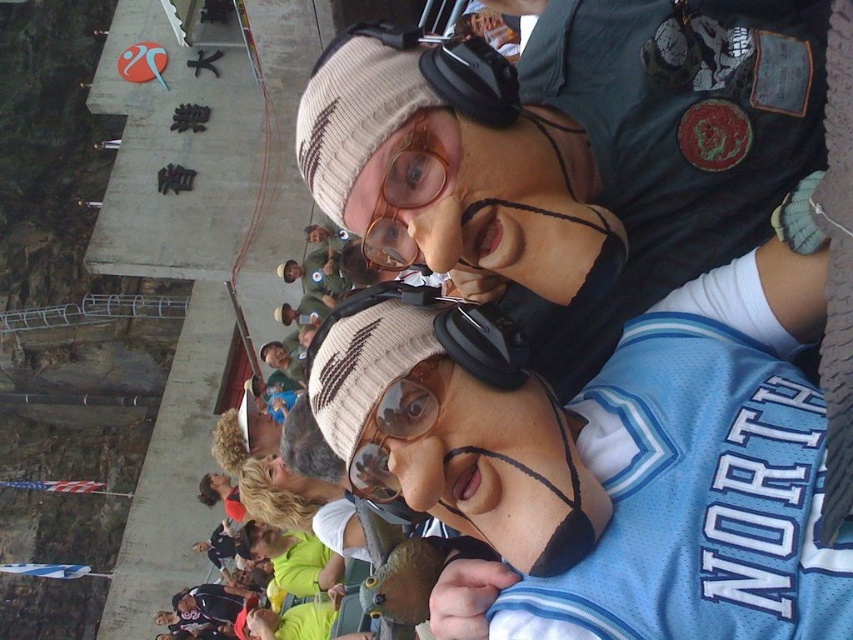
You are a photographer standing in front of the two people in the image. You notice the knit cap at upper center and the matte plastic goggles at center. Which object is closer to you?

The knit cap at upper center is closer to you because it is further to the viewer than the matte plastic goggles at center.

You are a photographer trying to capture a closeup of the knit cap at upper center and the clear plastic goggles at center. If you want to ensure both items are fully visible in the frame without cropping, which object should you adjust your camera focus towards to account for their sizes?

The knit cap at upper center is wider than the clear plastic goggles at center. To ensure both are fully visible, focus on the knit cap at upper center since it requires more space due to its greater width.